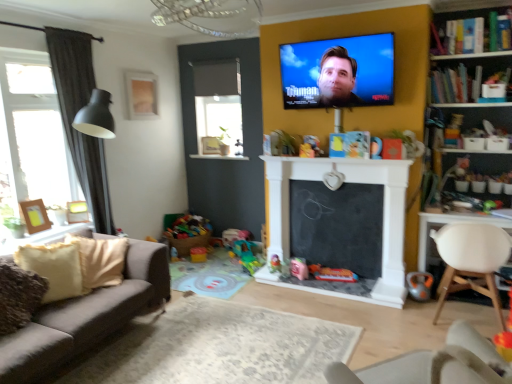
The image size is (512, 384). What do you see at coordinates (337, 225) in the screenshot? I see `black chalkboard at center` at bounding box center [337, 225].

The width and height of the screenshot is (512, 384). Describe the element at coordinates (141, 95) in the screenshot. I see `matte gold picture frame at upper left, which is counted as the 3th picture frame, starting from the bottom` at that location.

This screenshot has height=384, width=512. Find the location of `beige fabric pillow at lower left`. beige fabric pillow at lower left is located at coordinates (54, 268).

This screenshot has height=384, width=512. What do you see at coordinates (34, 130) in the screenshot? I see `clear glass window at left` at bounding box center [34, 130].

This screenshot has height=384, width=512. Identify the location of white plastic chair at lower right, which is counted as the 2th chair, starting from the back. (434, 363).

In order to click on black chalkboard at center in this screenshot , I will do `click(337, 225)`.

Based on the photo, could you measure the distance between white matte chair at right, the 2th chair when ordered from left to right, and pink fabric toy at center, marked as the 4th toy in a back-to-front arrangement?

white matte chair at right, the 2th chair when ordered from left to right, and pink fabric toy at center, marked as the 4th toy in a back-to-front arrangement, are 4.60 feet apart from each other.

In the scene shown: Which object is positioned more to the left, white matte chair at right, which is the 1th chair from right to left, or pink fabric toy at center, marked as the 4th toy in a back-to-front arrangement?

Positioned to the left is pink fabric toy at center, marked as the 4th toy in a back-to-front arrangement.

Between white matte chair at right, the 2th chair when ordered from left to right, and pink fabric toy at center, the fourth toy positioned from the bottom, which one is positioned behind?

pink fabric toy at center, the fourth toy positioned from the bottom, is behind.

Can you see white matte chair at right, positioned as the 1th chair in back-to-front order, touching pink fabric toy at center, the fourth toy positioned from the bottom?

No, white matte chair at right, positioned as the 1th chair in back-to-front order, is not with pink fabric toy at center, the fourth toy positioned from the bottom.

From a real-world perspective, between beige carpet at center and metallic orange toy at lower right, the seventh toy positioned from the back, who is vertically lower?

beige carpet at center, from a real-world perspective.

Are beige carpet at center and metallic orange toy at lower right, the seventh toy positioned from the back, located far from each other?

That's right, there is a large distance between beige carpet at center and metallic orange toy at lower right, the seventh toy positioned from the back.

Are plush yellow toy at center, the 7th toy positioned from the bottom, and pink fabric toy at center, marked as the 4th toy in a back-to-front arrangement, making contact?

plush yellow toy at center, the 7th toy positioned from the bottom, is not next to pink fabric toy at center, marked as the 4th toy in a back-to-front arrangement, and they're not touching.

Is point (315, 155) less distant than point (290, 261)?

Yes, point (315, 155) is in front of point (290, 261).

Can you confirm if plush yellow toy at center, the second toy in the front-to-back sequence, is bigger than pink fabric toy at center, which is the fourth toy in left-to-right order?

No, plush yellow toy at center, the second toy in the front-to-back sequence, is not bigger than pink fabric toy at center, which is the fourth toy in left-to-right order.

Does plush yellow toy at center, the sixth toy in the back-to-front sequence, come in front of pink fabric toy at center, placed as the 4th toy when sorted from right to left?

Yes, plush yellow toy at center, the sixth toy in the back-to-front sequence, is in front of pink fabric toy at center, placed as the 4th toy when sorted from right to left.

Is clear glass window at left completely or partially outside of dark grey fabric curtain at left?

That's correct, clear glass window at left is outside of dark grey fabric curtain at left.

What's the angular difference between clear glass window at left and dark grey fabric curtain at left's facing directions?

4.98e-05 degrees.

Which of these two, clear glass window at left or dark grey fabric curtain at left, stands taller?

Standing taller between the two is dark grey fabric curtain at left.

In the image, is clear glass window at left positioned in front of or behind dark grey fabric curtain at left?

Visually, clear glass window at left is located in front of dark grey fabric curtain at left.

From a real-world perspective, is plastic colorful toy at center, placed as the 3th toy when sorted from front to back, physically above wooden bookshelf at upper right?

No, from a real-world perspective, plastic colorful toy at center, placed as the 3th toy when sorted from front to back, is not over wooden bookshelf at upper right

Is plastic colorful toy at center, placed as the 3th toy when sorted from front to back, directly adjacent to wooden bookshelf at upper right?

No, plastic colorful toy at center, placed as the 3th toy when sorted from front to back, is not making contact with wooden bookshelf at upper right.

Choose the correct answer: Is plastic colorful toy at center, the second toy in the right-to-left sequence, inside wooden bookshelf at upper right or outside it?

plastic colorful toy at center, the second toy in the right-to-left sequence, is not inside wooden bookshelf at upper right, it's outside.

What's the angular difference between plastic colorful toy at center, which is the second toy in bottom-to-top order, and wooden bookshelf at upper right's facing directions?

plastic colorful toy at center, which is the second toy in bottom-to-top order, and wooden bookshelf at upper right are facing 6.96e-05 degrees away from each other.

Are plastic colorful toy at center, which is the fifth toy from back to front, and black chalkboard at center making contact?

No, plastic colorful toy at center, which is the fifth toy from back to front, is not making contact with black chalkboard at center.

How different are the orientations of plastic colorful toy at center, placed as the 3th toy when sorted from front to back, and black chalkboard at center in degrees?

0.00017 degrees separate the facing orientations of plastic colorful toy at center, placed as the 3th toy when sorted from front to back, and black chalkboard at center.

From the picture: Is plastic colorful toy at center, which ranks as the sixth toy in top-to-bottom order, to the left or to the right of black chalkboard at center in the image?

In the image, plastic colorful toy at center, which ranks as the sixth toy in top-to-bottom order, appears on the right side of black chalkboard at center.

From the image's perspective, is plastic colorful toy at center, which ranks as the sixth toy in top-to-bottom order, on top of black chalkboard at center?

Incorrect, from the image's perspective, plastic colorful toy at center, which ranks as the sixth toy in top-to-bottom order, is lower than black chalkboard at center.

Based on the photo, would you say beige fabric pillow at lower left is to the left or to the right of wooden photo frame at left, the 1th picture frame from the left, in the picture?

Clearly, beige fabric pillow at lower left is on the right of wooden photo frame at left, the 1th picture frame from the left, in the image.

Can we say beige fabric pillow at lower left lies outside wooden photo frame at left, the first picture frame in the front-to-back sequence?

Indeed, beige fabric pillow at lower left is completely outside wooden photo frame at left, the first picture frame in the front-to-back sequence.

From the image's perspective, between beige fabric pillow at lower left and wooden photo frame at left, the 1th picture frame from the left, which one is located above?

wooden photo frame at left, the 1th picture frame from the left, from the image's perspective.

Find the location of a particular element. Image resolution: width=512 pixels, height=384 pixels. chair that is the 2nd object located above the pink fabric toy at center, the fourth toy in the front-to-back sequence (from the image's perspective) is located at coordinates (471, 260).

Image resolution: width=512 pixels, height=384 pixels. In order to click on plain in front of the metallic orange toy at lower right, the first toy when ordered from right to left in this screenshot , I will do `click(220, 347)`.

Based on their spatial positions, is plastic green toy at center, arranged as the fifth toy when viewed from the top, or beige fabric pillow at lower left closer to pink fabric toy at center, the fourth toy positioned from the bottom?

plastic green toy at center, arranged as the fifth toy when viewed from the top, is closer to pink fabric toy at center, the fourth toy positioned from the bottom.

From the image, which object appears to be farther from wooden picture frame at left, which ranks as the second picture frame in top-to-bottom order, wooden bookshelf at upper right or beige fabric pillow at lower left?

wooden bookshelf at upper right is positioned further to the anchor wooden picture frame at left, which ranks as the second picture frame in top-to-bottom order.

From the image, which object appears to be farther from bright multicolored plastic toys at lower left, the 2th toy viewed from the top, velvet brown couch at lower left or clear glass window at left?

velvet brown couch at lower left is further to bright multicolored plastic toys at lower left, the 2th toy viewed from the top.

From the image, which object appears to be farther from matte gold picture frame at upper left, which is counted as the 3th picture frame, starting from the bottom, dark grey fabric curtain at left or metallic orange toy at lower right, the 1th toy in the front-to-back sequence?

metallic orange toy at lower right, the 1th toy in the front-to-back sequence.

Estimate the real-world distances between objects in this image. Which object is closer to wooden picture frame at left, which appears as the second picture frame when ordered from the bottom, dark grey fabric curtain at left or velvet brown couch at lower left?

The object closer to wooden picture frame at left, which appears as the second picture frame when ordered from the bottom, is dark grey fabric curtain at left.

Estimate the real-world distances between objects in this image. Which object is further from clear glass window at left, pink fabric toy at center, which is the fourth toy in left-to-right order, or wooden picture frame at left, the 2th picture frame from the right?

Based on the image, pink fabric toy at center, which is the fourth toy in left-to-right order, appears to be further to clear glass window at left.

Considering their positions, is beige fabric pillow at lower left positioned closer to velvet brown couch at lower left than plastic green toy at center, the third toy viewed from the left?

beige fabric pillow at lower left is closer to velvet brown couch at lower left.

In the scene shown: When comparing their distances from metallic orange toy at lower right, the first toy when ordered from right to left, does beige fabric pillow at lower left or matte gold picture frame at upper left, positioned as the 3th picture frame in front-to-back order, seem closer?

beige fabric pillow at lower left.

Locate an element on the screen. television between beige fabric pillow at lower left and white plastic chair at lower right, which is counted as the 2th chair, starting from the back, from left to right is located at coordinates (339, 72).

What are the coordinates of `picture frame located between velvet brown couch at lower left and white matte chair at right, the 2th chair when ordered from left to right, in the left-right direction` in the screenshot? It's located at (141, 95).

Locate an element on the screen. toy between rubberized plastic toy at center, positioned as the fifth toy in bottom-to-top order, and plastic green toy at center, which appears as the 5th toy when viewed from the front is located at coordinates (188, 233).

The image size is (512, 384). I want to click on curtain between velvet brown couch at lower left and bright multicolored plastic toys at lower left, which is counted as the 6th toy, starting from the right, along the z-axis, so click(x=74, y=116).